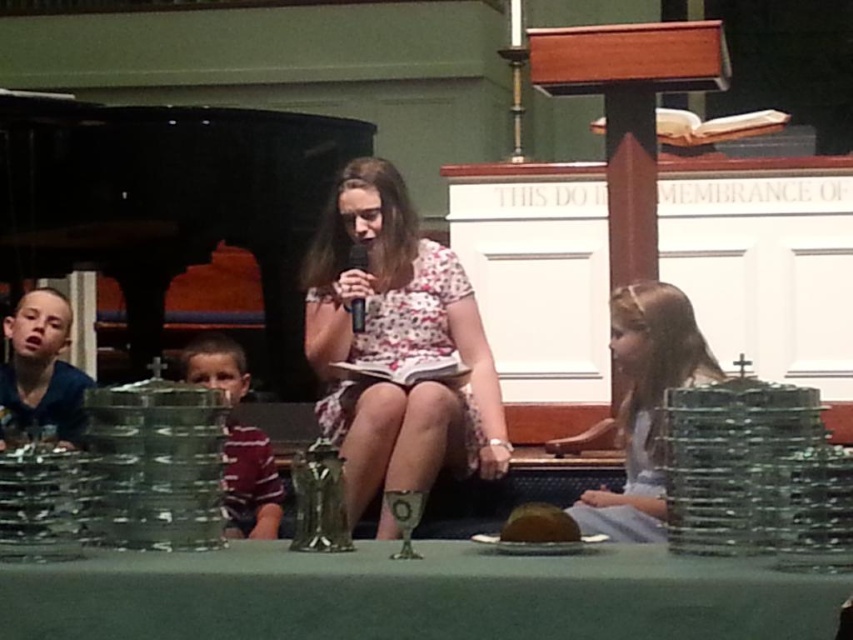
You are standing at the entrance of the church and want to locate the light blue fabric dress at center. According to the coordinates provided, in which direction relative to the entrance should you look to find it?

The light blue fabric dress at center is located at coordinates point (642, 406). Since the coordinate system typically places the origin at the bottom left corner, the dress is positioned to the right and slightly above the entrance.

You are organizing a small event in this church and need to place a 1.2 meter long banner between the green felt table at center and the blue cotton shirt at left. Is there enough space between them to accommodate the banner?

The green felt table at center has a smaller size compared to blue cotton shirt at left, but the description does not provide specific distance measurements between them. Therefore, it is unclear if there is enough space to place the 1.2 meter long banner between them.